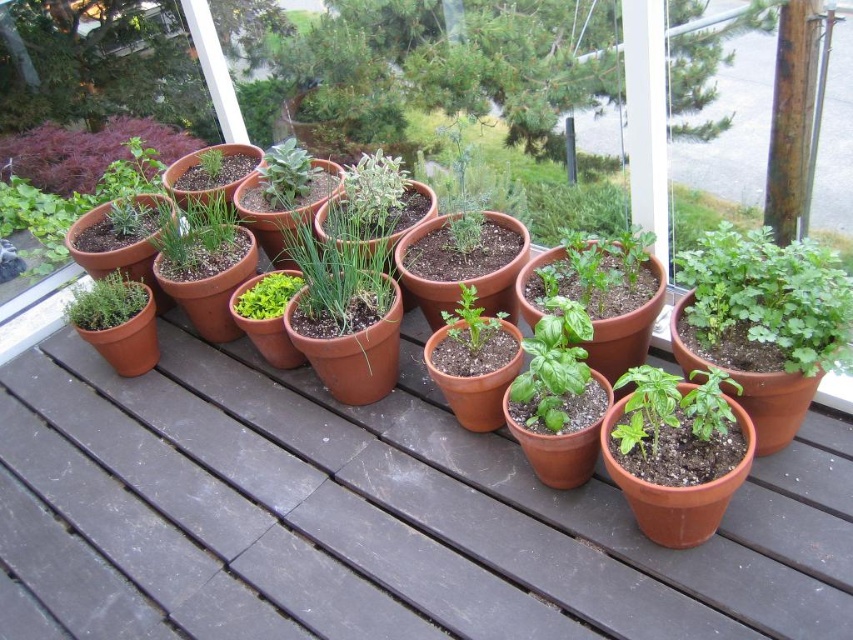
Question: Which point is farther to the camera?

Choices:
 (A) green matte herb at center-right
 (B) green matte basil at center
 (C) green matte herb at center

Answer: (C)

Question: Which point is farther to the camera?

Choices:
 (A) green matte herb at center-right
 (B) green matte herb at left

Answer: (B)

Question: Does green matte herb at center-right have a lesser width compared to green matte basil at center?

Choices:
 (A) yes
 (B) no

Answer: (B)

Question: Considering the relative positions of green matte basil at center and green matte herb at left in the image provided, where is green matte basil at center located with respect to green matte herb at left?

Choices:
 (A) right
 (B) left

Answer: (A)

Question: Which point is closer to the camera?

Choices:
 (A) green matte basil at center
 (B) green matte herb at center
 (C) green matte leafy plant at center

Answer: (A)

Question: Is green matte herb at left in front of green matte herb at upper center?

Choices:
 (A) no
 (B) yes

Answer: (B)